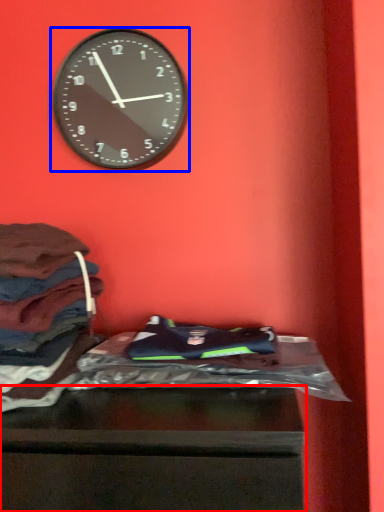
Question: Among these objects, which one is nearest to the camera, furniture (highlighted by a red box) or wall clock (highlighted by a blue box)?

Choices:
 (A) furniture
 (B) wall clock

Answer: (A)